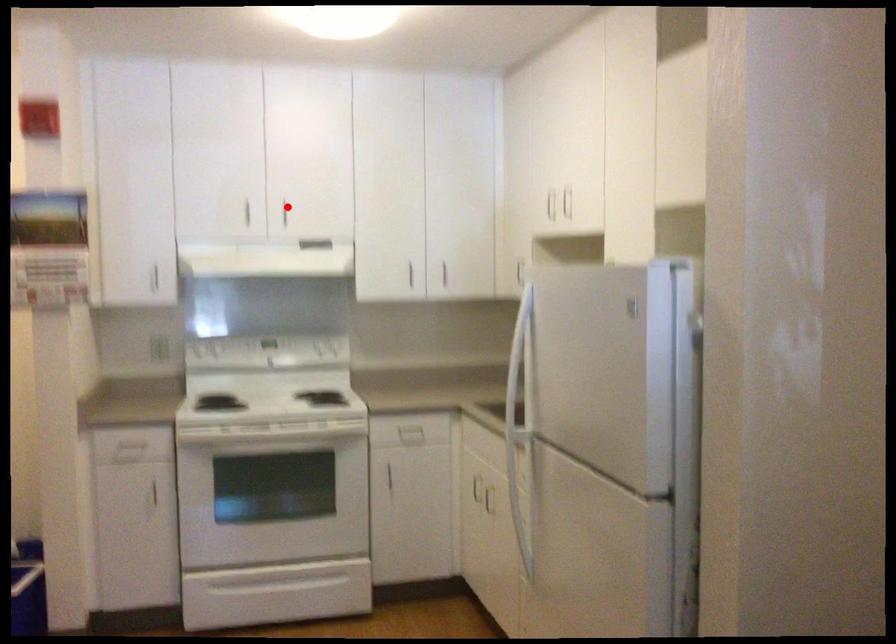
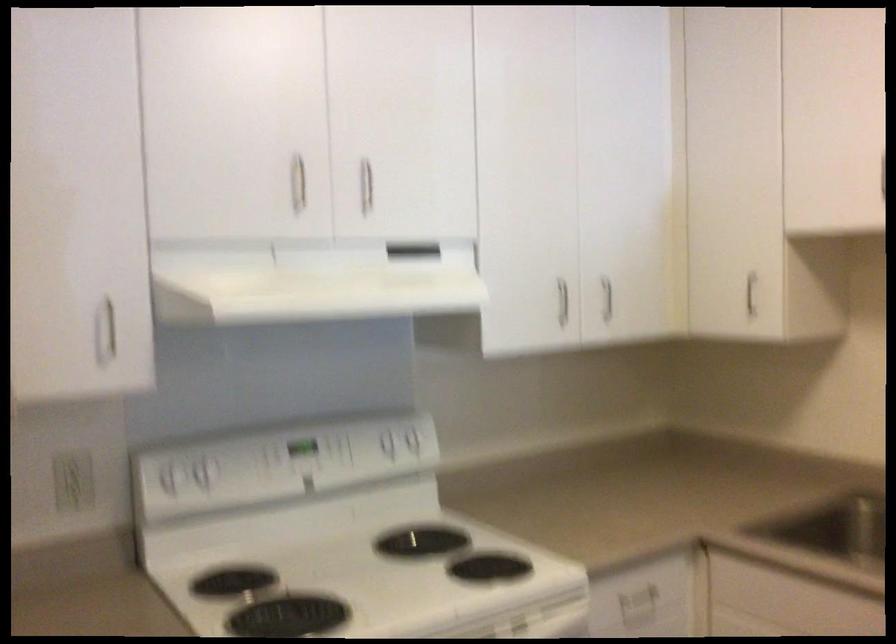
In the second image, find the point that corresponds to the highlighted location in the first image.

(366, 185)